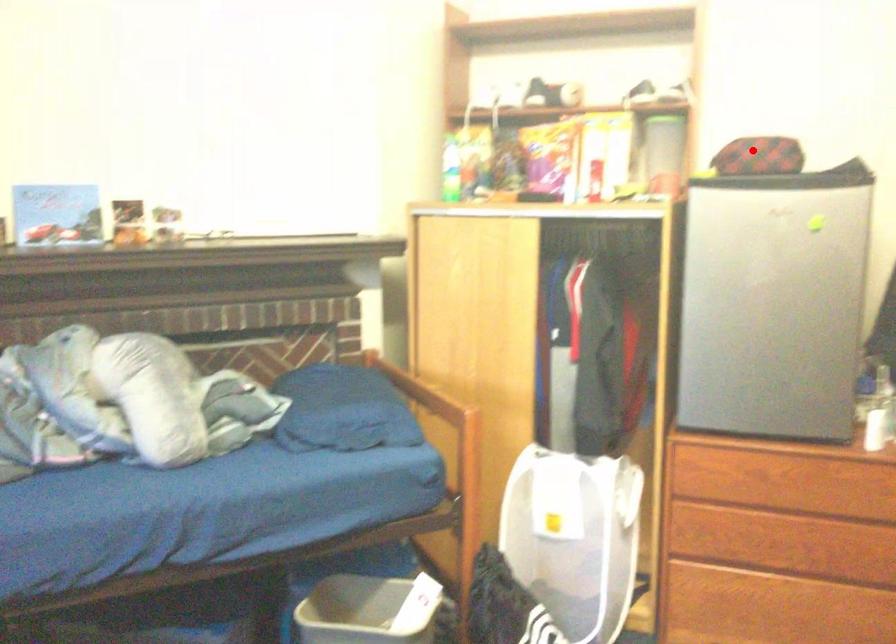
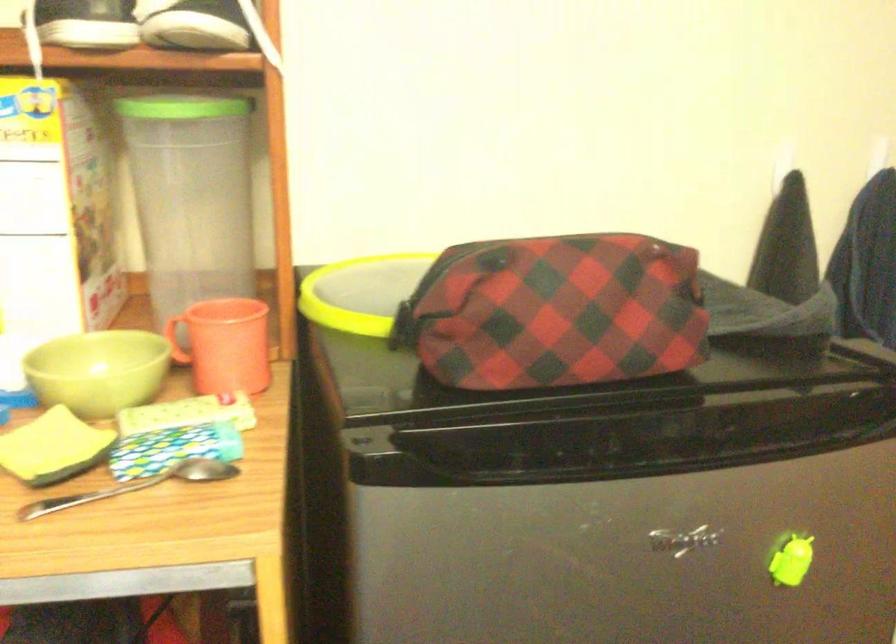
Find the pixel in the second image that matches the highlighted location in the first image.

(556, 312)